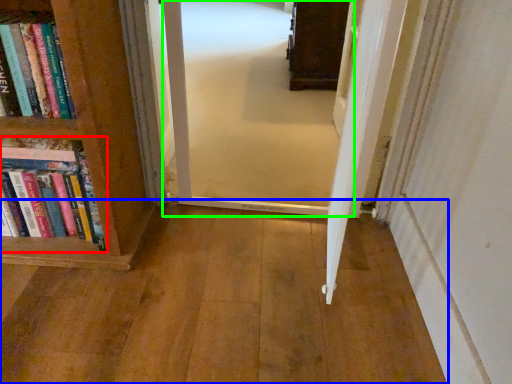
Question: Estimate the real-world distances between objects in this image. Which object is farther from book (highlighted by a red box), corridor (highlighted by a blue box) or corridor (highlighted by a green box)?

Choices:
 (A) corridor
 (B) corridor

Answer: (B)